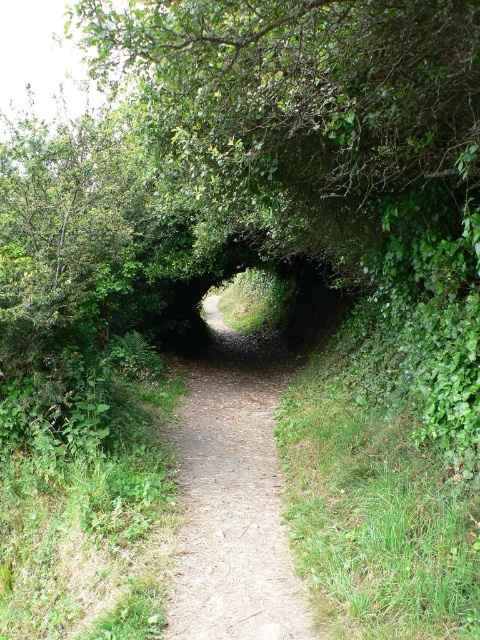
Question: Can you confirm if green leafy tree at center is positioned to the left of dirt path at center?

Choices:
 (A) yes
 (B) no

Answer: (B)

Question: Which of the following is the farthest from the observer?

Choices:
 (A) dirt path at center
 (B) green leafy tree at center

Answer: (A)

Question: Can you confirm if green leafy tree at center is positioned below dirt path at center?

Choices:
 (A) no
 (B) yes

Answer: (A)

Question: Which point is closer to the camera?

Choices:
 (A) (255, 218)
 (B) (257, 531)

Answer: (B)

Question: Does green leafy tree at center lie in front of dirt path at center?

Choices:
 (A) no
 (B) yes

Answer: (B)